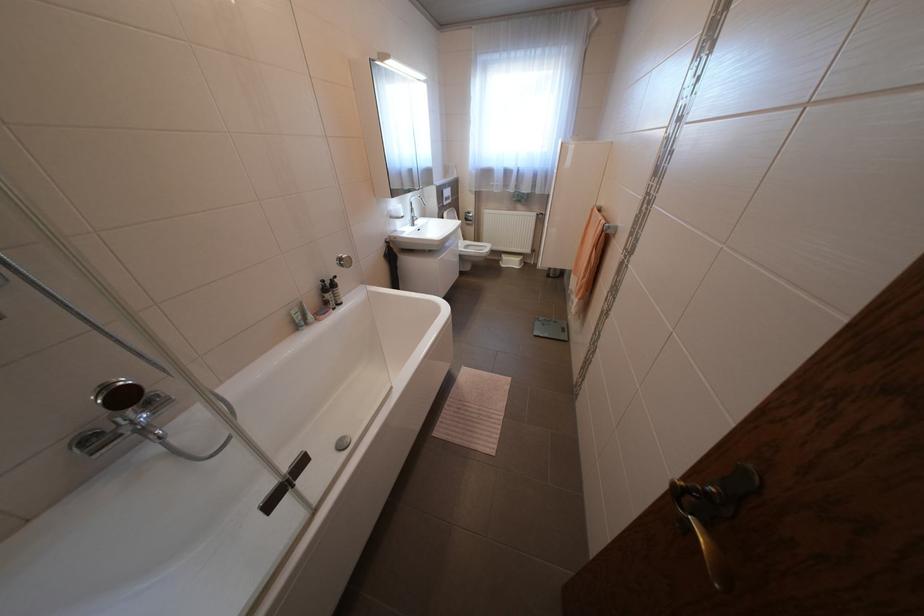
Describe the element at coordinates (713, 513) in the screenshot. I see `a door handle` at that location.